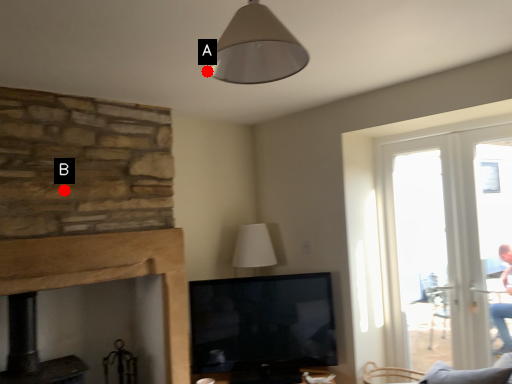
Question: Two points are circled on the image, labeled by A and B beside each circle. Which point appears farthest from the camera in this image?

Choices:
 (A) A is further
 (B) B is further

Answer: (B)